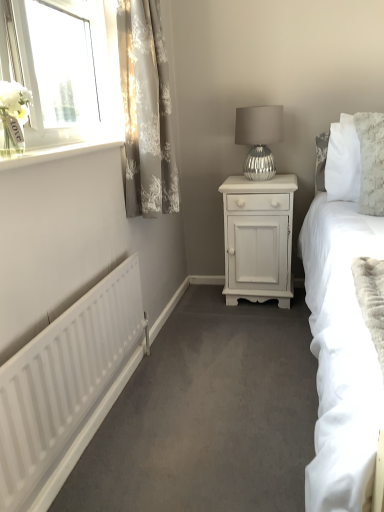
Locate an element on the screen. vacant location below gray floral fabric curtain at upper left (from a real-world perspective) is located at coordinates (169, 337).